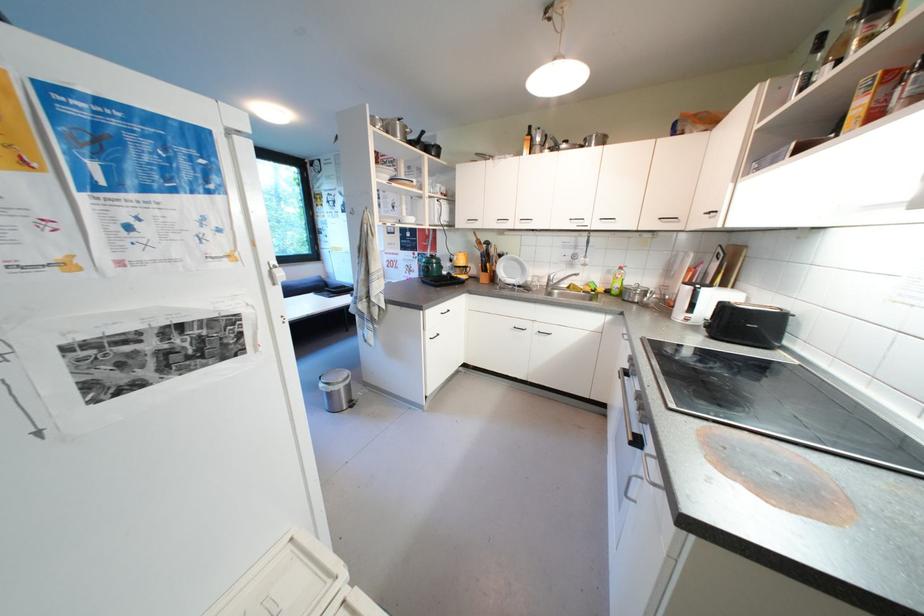
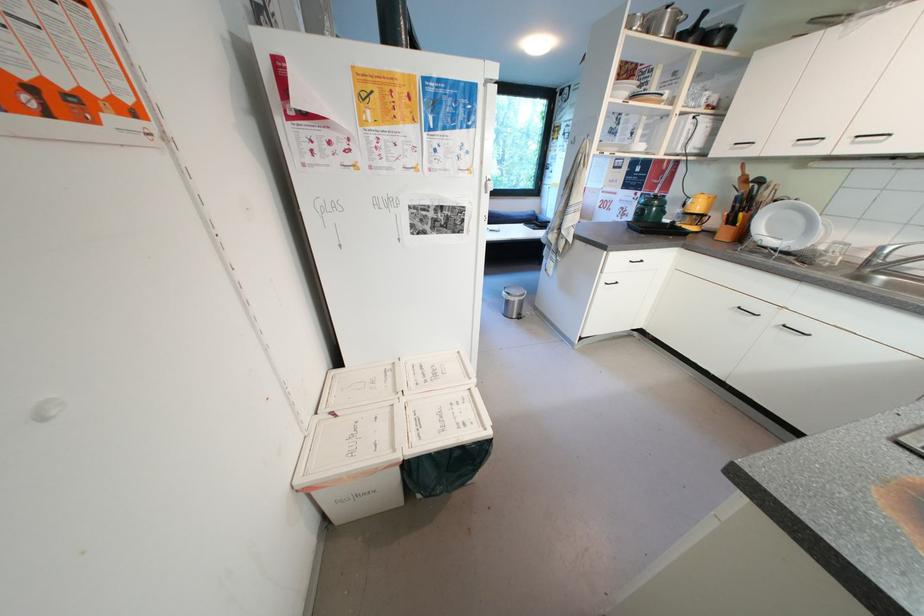
In the second image, find the point that corresponds to the point at 543,281 in the first image.

(845, 249)